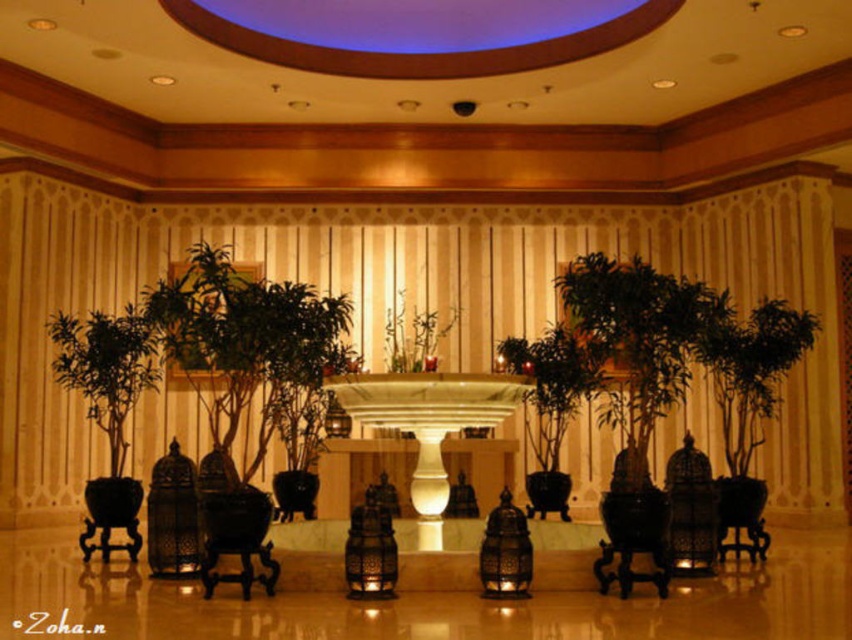
You are a maintenance worker in the lobby. You need to clean the green matte plant at left and the green matte vase at center. Which one should you clean first if you want to start from the bottom?

The green matte plant at left should be cleaned first because it is located below the green matte vase at center.

You are a visitor in this lobby and want to know which object is taller between the green matte plant at left and the metallic ornate lantern at center. Can you tell me?

The green matte plant at left is taller than the metallic ornate lantern at center.

You are a guest entering the lobby and want to place a small potted plant between the metallic ornate lantern at center and the green matte vase at center. Can you do this without moving either object?

The metallic ornate lantern at center is below the green matte vase at center, so there is no space between them horizontally. Therefore, you cannot place a small potted plant between them without moving either object.